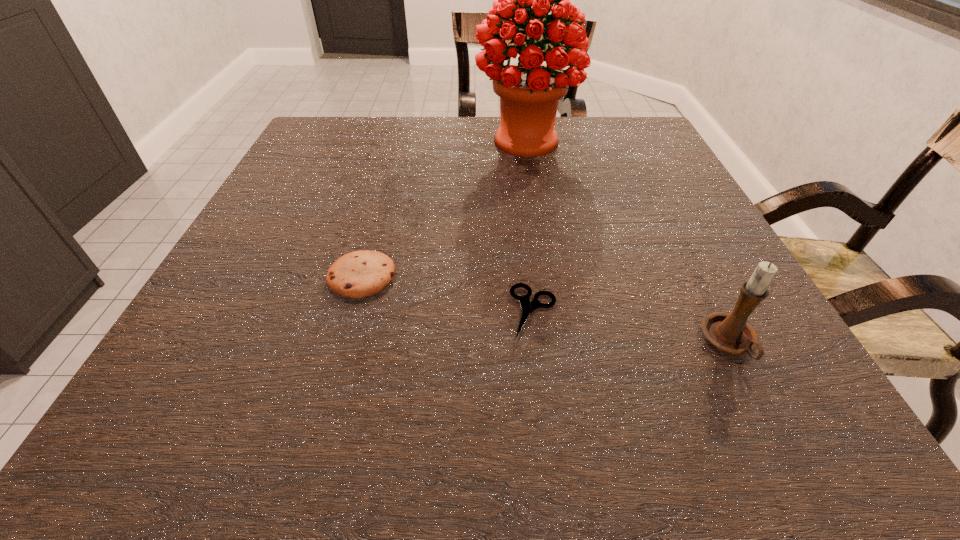
Image resolution: width=960 pixels, height=540 pixels. Identify the location of vacant space located on the right of the shears. (665, 312).

At what (x,y) coordinates should I click in order to perform the action: click on object situated at the far edge. Please return your answer as a coordinate pair (x, y). The height and width of the screenshot is (540, 960). Looking at the image, I should click on (529, 91).

Where is `object located in the right edge section of the desktop`? Image resolution: width=960 pixels, height=540 pixels. object located in the right edge section of the desktop is located at coordinates (730, 332).

Identify the location of vacant space at the far edge of the desktop. The height and width of the screenshot is (540, 960). (417, 128).

You are a GUI agent. You are given a task and a screenshot of the screen. Output one action in this format:
    pyautogui.click(x=<x>, y=<y>)
    Task: Click on the blank space at the near edge
    The height and width of the screenshot is (540, 960).
    Given the screenshot: What is the action you would take?
    pyautogui.click(x=380, y=414)

Find the location of `vacant region at the left edge of the desktop`. vacant region at the left edge of the desktop is located at coordinates (295, 166).

The height and width of the screenshot is (540, 960). Identify the location of free space at the right edge. (660, 177).

At what (x,y) coordinates should I click in order to perform the action: click on free space at the far left corner of the desktop. Please return your answer as a coordinate pair (x, y). The image size is (960, 540). Looking at the image, I should click on (361, 137).

Find the location of a particular element. vacant region between the farthest object and the candle holder is located at coordinates (628, 241).

You are a GUI agent. You are given a task and a screenshot of the screen. Output one action in this format:
    pyautogui.click(x=<x>, y=<y>)
    Task: Click on the vacant space that's between the third shortest object and the farthest object
    The width and height of the screenshot is (960, 540).
    Given the screenshot: What is the action you would take?
    pyautogui.click(x=628, y=241)